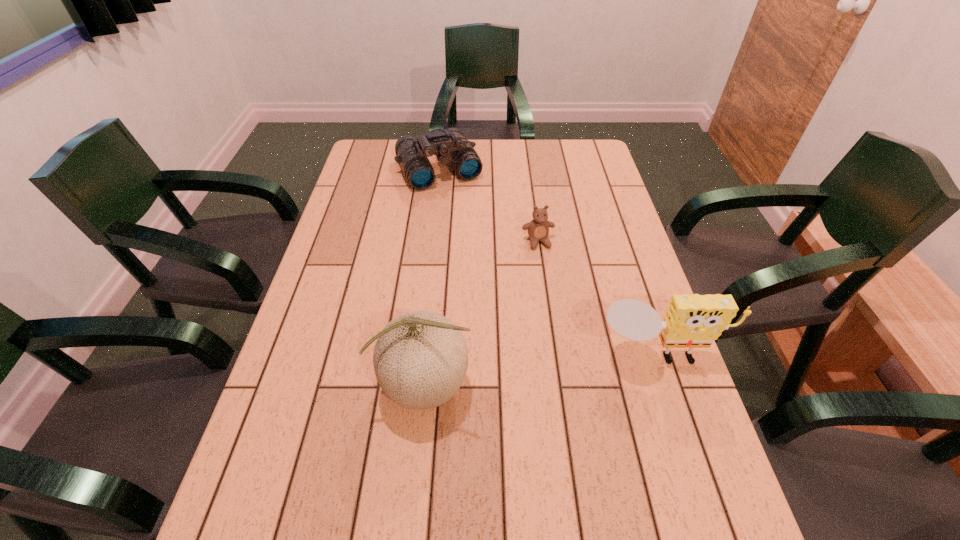
The image size is (960, 540). I want to click on vacant space located 0.180m on the front-facing side of the second object from right to left, so click(x=556, y=297).

This screenshot has width=960, height=540. I want to click on vacant space located 0.320m on the front-facing side of the second object from right to left, so click(569, 341).

I want to click on vacant region located 0.210m through the lenses of the second shortest object, so click(473, 230).

Locate an element on the screen. free space located through the lenses of the second shortest object is located at coordinates (458, 202).

This screenshot has height=540, width=960. I want to click on free space located through the lenses of the second shortest object, so click(492, 262).

The width and height of the screenshot is (960, 540). Identify the location of object that is at the far edge. (450, 145).

At what (x,y) coordinates should I click in order to perform the action: click on object at the left edge. Please return your answer as a coordinate pair (x, y). This screenshot has width=960, height=540. Looking at the image, I should click on (450, 145).

Locate an element on the screen. object present at the right edge is located at coordinates (691, 321).

I want to click on object that is at the far left corner, so pos(450,145).

Where is `vacant area at the far edge of the desktop`? The height and width of the screenshot is (540, 960). vacant area at the far edge of the desktop is located at coordinates (534, 164).